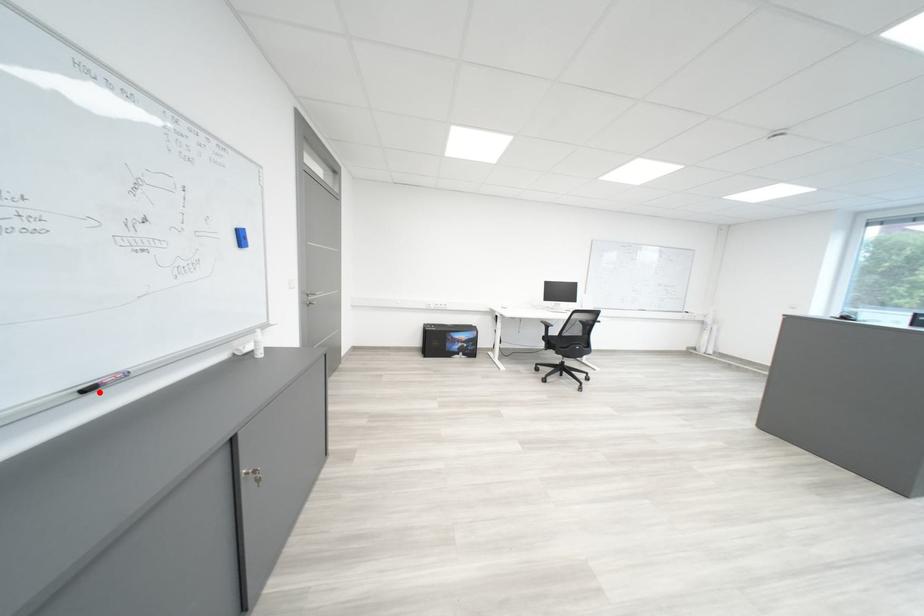
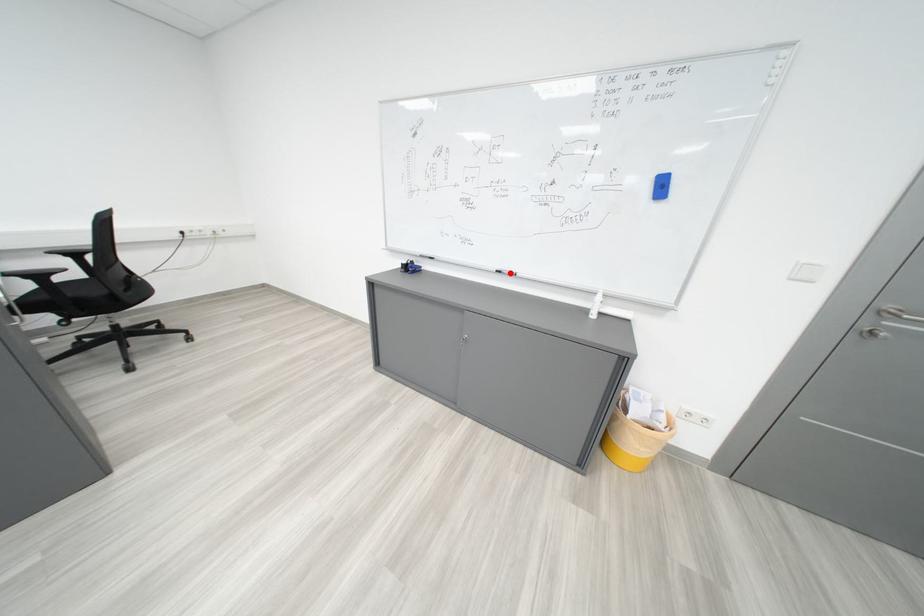
From the picture: I am providing you with two images of the same scene from different viewpoints. A red point is marked on the first image and another point is marked on the second image. Is the marked point in image1 the same physical position as the marked point in image2?

Yes